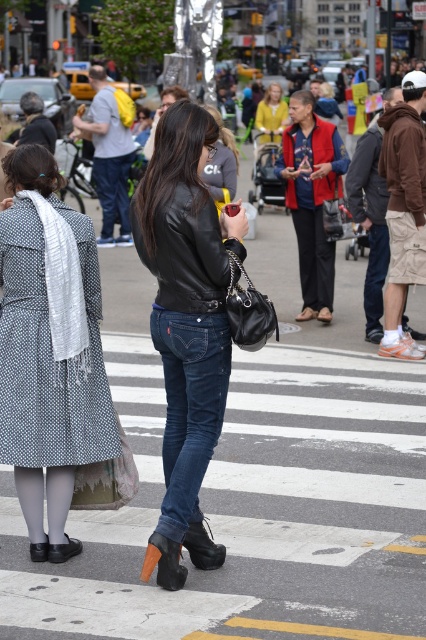
You are a photographer trying to capture both the polka dot dress at center and the leather jacket at center in a single frame. Based on their positions, which one is positioned lower in the image?

The polka dot dress at center is located below the leather jacket at center, so it is positioned lower in the image.

You are a photographer standing at the crosswalk and want to take a photo of both the polka dot dress at center and the leather jacket at center. Which one should you focus on first to ensure they are both in clear focus?

The polka dot dress at center is closer to you than the leather jacket at center, so you should focus on the polka dot dress at center first to ensure both are in clear focus.

You are a fashion designer observing the urban street scene. You notice the polka dot dress at center and the dark blue denim jeans at center. Which clothing item appears larger in size?

The polka dot dress at center is bigger than dark blue denim jeans at center, so the polka dot dress at center appears larger in size.